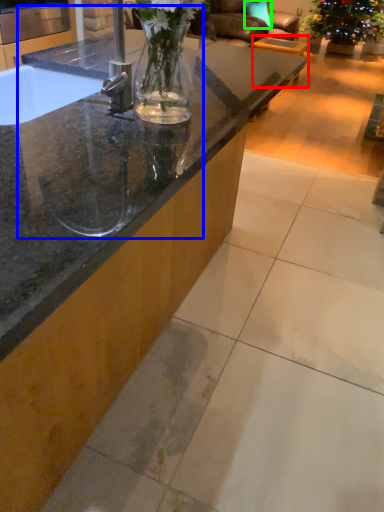
Question: Which object is positioned farthest from table (highlighted by a red box)? Select from sink (highlighted by a blue box) and pillow (highlighted by a green box).

Choices:
 (A) sink
 (B) pillow

Answer: (A)